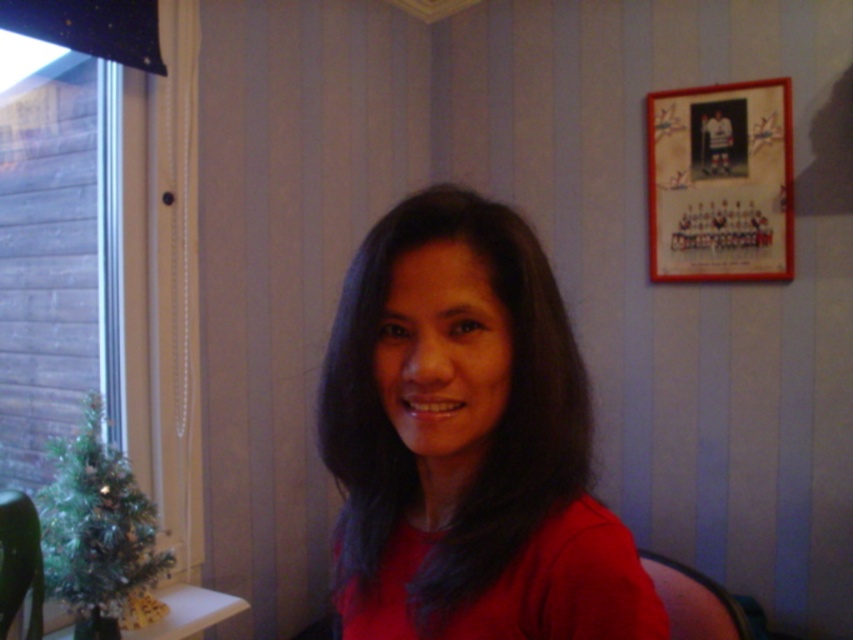
Question: Can you confirm if clear glass window at left is positioned to the left of green glossy table at lower left?

Choices:
 (A) no
 (B) yes

Answer: (B)

Question: Which object is positioned farthest from the clear glass window at left?

Choices:
 (A) matte red shirt at center
 (B) green glossy table at lower left

Answer: (A)

Question: Which point is farther to the camera?

Choices:
 (A) matte red shirt at center
 (B) green glossy table at lower left
 (C) clear glass window at left

Answer: (C)

Question: Which of these objects is positioned closest to the clear glass window at left?

Choices:
 (A) matte red shirt at center
 (B) green glossy table at lower left

Answer: (B)

Question: Does matte red shirt at center have a smaller size compared to clear glass window at left?

Choices:
 (A) yes
 (B) no

Answer: (B)

Question: Is the position of matte red shirt at center more distant than that of green glossy table at lower left?

Choices:
 (A) yes
 (B) no

Answer: (B)